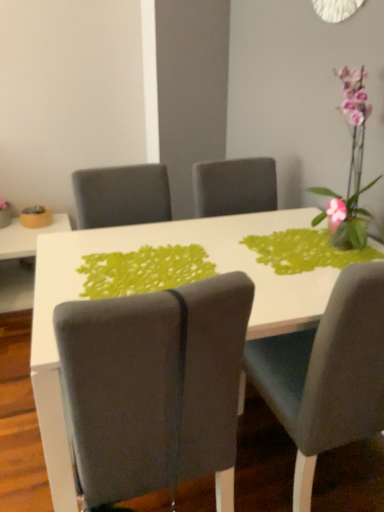
Where is `vacant area on the back side of green fabric placemat at center`? vacant area on the back side of green fabric placemat at center is located at coordinates (190, 230).